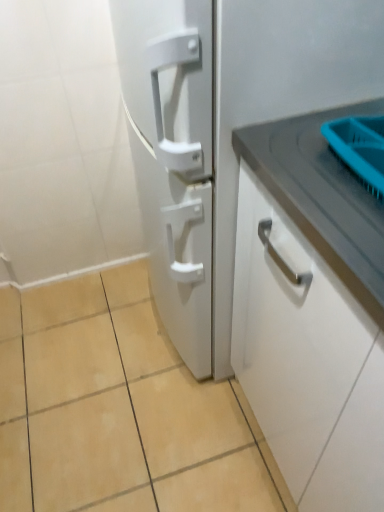
This screenshot has height=512, width=384. What do you see at coordinates (306, 360) in the screenshot?
I see `white matte cabinet handle at right` at bounding box center [306, 360].

Where is `white matte cabinet handle at right`? white matte cabinet handle at right is located at coordinates (306, 360).

Identify the location of white matte refrigerator at center. click(x=245, y=142).

The height and width of the screenshot is (512, 384). Describe the element at coordinates (115, 408) in the screenshot. I see `beige ceramic tile at lower center` at that location.

Identify the location of white matte cabinet handle at right. The height and width of the screenshot is (512, 384). (306, 360).

Could white matte refrigerator at center be considered to be inside beige ceramic tile at lower center?

No, white matte refrigerator at center is not a part of beige ceramic tile at lower center.

From a real-world perspective, is beige ceramic tile at lower center on white matte refrigerator at center?

No.

Between beige ceramic tile at lower center and white matte refrigerator at center, which one is positioned in front?

Positioned in front is white matte refrigerator at center.

Are white matte refrigerator at center and white matte cabinet handle at right beside each other?

No, white matte refrigerator at center is not beside white matte cabinet handle at right.

Is white matte refrigerator at center smaller than white matte cabinet handle at right?

Actually, white matte refrigerator at center might be larger than white matte cabinet handle at right.

From the image's perspective, would you say white matte refrigerator at center is positioned over white matte cabinet handle at right?

Yes, from the image's perspective, white matte refrigerator at center is above white matte cabinet handle at right.

Considering the positions of points (324, 225) and (379, 352), is point (324, 225) closer to camera compared to point (379, 352)?

That is False.

Considering the sizes of objects white matte refrigerator at center and beige ceramic tile at lower center in the image provided, who is smaller, white matte refrigerator at center or beige ceramic tile at lower center?

With smaller size is beige ceramic tile at lower center.

Does white matte refrigerator at center contain beige ceramic tile at lower center?

No, white matte refrigerator at center does not contain beige ceramic tile at lower center.

Looking at their sizes, would you say white matte refrigerator at center is wider or thinner than beige ceramic tile at lower center?

Clearly, white matte refrigerator at center has less width compared to beige ceramic tile at lower center.

Considering the positions of point (317, 65) and point (34, 484), is point (317, 65) closer or farther from the camera than point (34, 484)?

Point (317, 65).

Could you tell me if beige ceramic tile at lower center is turned towards white matte cabinet handle at right?

No, beige ceramic tile at lower center is not aimed at white matte cabinet handle at right.

Is beige ceramic tile at lower center to the left of white matte cabinet handle at right from the viewer's perspective?

Correct, you'll find beige ceramic tile at lower center to the left of white matte cabinet handle at right.

Considering the sizes of beige ceramic tile at lower center and white matte cabinet handle at right in the image, is beige ceramic tile at lower center taller or shorter than white matte cabinet handle at right?

Clearly, beige ceramic tile at lower center is shorter compared to white matte cabinet handle at right.

Is beige ceramic tile at lower center positioned far away from white matte cabinet handle at right?

They are positioned close to each other.

Which object is thinner, white matte cabinet handle at right or beige ceramic tile at lower center?

With smaller width is white matte cabinet handle at right.

Consider the image. Is white matte cabinet handle at right outside of beige ceramic tile at lower center?

Absolutely, white matte cabinet handle at right is external to beige ceramic tile at lower center.

Is white matte cabinet handle at right facing towards beige ceramic tile at lower center?

No, white matte cabinet handle at right is not facing towards beige ceramic tile at lower center.

From the image's perspective, which object appears higher, white matte cabinet handle at right or beige ceramic tile at lower center?

From the image's view, white matte cabinet handle at right is above.

Considering the sizes of objects white matte cabinet handle at right and white matte refrigerator at center in the image provided, who is shorter, white matte cabinet handle at right or white matte refrigerator at center?

white matte cabinet handle at right.

Considering the positions of point (292, 378) and point (158, 28), is point (292, 378) closer or farther from the camera than point (158, 28)?

Point (292, 378) is positioned farther from the camera compared to point (158, 28).

In the scene shown: Is white matte cabinet handle at right next to white matte refrigerator at center?

There is a gap between white matte cabinet handle at right and white matte refrigerator at center.

From a real-world perspective, is white matte cabinet handle at right below white matte refrigerator at center?

Yes, from a real-world perspective, white matte cabinet handle at right is beneath white matte refrigerator at center.

Identify the location of ceramic tile below the white matte refrigerator at center (from a real-world perspective). This screenshot has width=384, height=512. (115, 408).

The width and height of the screenshot is (384, 512). What are the coordinates of `cabinetry in front of the white matte refrigerator at center` in the screenshot? It's located at (306, 360).

Looking at the image, which one is located further to white matte cabinet handle at right, beige ceramic tile at lower center or white matte refrigerator at center?

Based on the image, beige ceramic tile at lower center appears to be further to white matte cabinet handle at right.

Estimate the real-world distances between objects in this image. Which object is closer to white matte cabinet handle at right, white matte refrigerator at center or beige ceramic tile at lower center?

white matte refrigerator at center lies closer to white matte cabinet handle at right than the other object.

Based on their spatial positions, is white matte cabinet handle at right or white matte refrigerator at center further from beige ceramic tile at lower center?

Based on the image, white matte cabinet handle at right appears to be further to beige ceramic tile at lower center.

Which object lies further to the anchor point white matte refrigerator at center, white matte cabinet handle at right or beige ceramic tile at lower center?

The object further to white matte refrigerator at center is beige ceramic tile at lower center.

Based on their spatial positions, is white matte refrigerator at center or white matte cabinet handle at right closer to beige ceramic tile at lower center?

white matte refrigerator at center is closer to beige ceramic tile at lower center.

When comparing their distances from white matte refrigerator at center, does beige ceramic tile at lower center or white matte cabinet handle at right seem closer?

The object closer to white matte refrigerator at center is white matte cabinet handle at right.

Locate an element on the screen. refrigerator located between beige ceramic tile at lower center and white matte cabinet handle at right in the left-right direction is located at coordinates (245, 142).